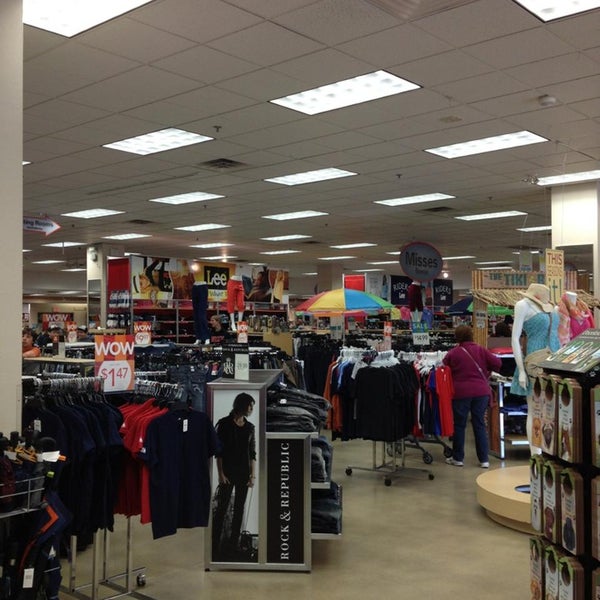
The image size is (600, 600). Identify the location of ceiling. (377, 136).